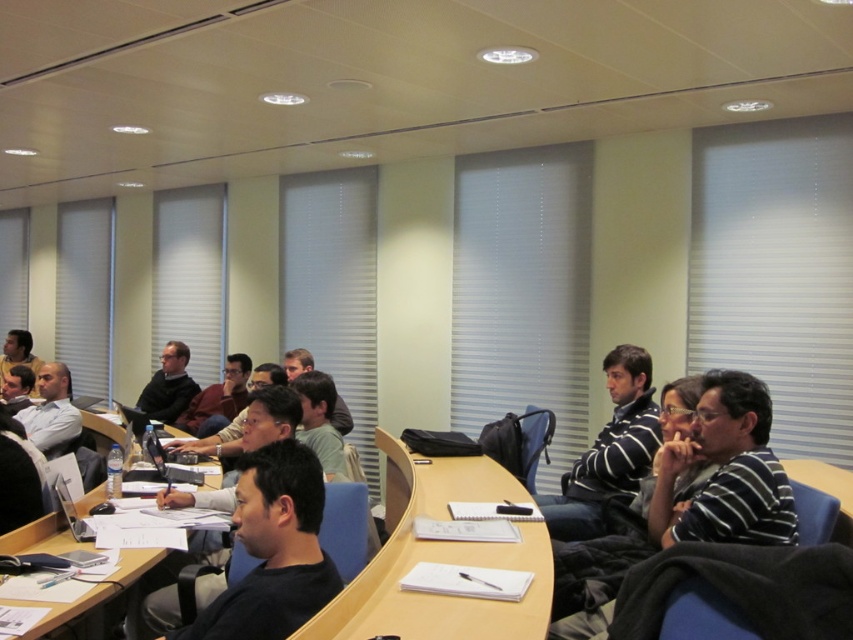
You are organizing a small presentation in the classroom and need to place a laptop on the desk. The laptop requires a space larger than the wooden at center. Can you place it where the matte black glasses at center are currently located?

The wooden at center occupies less space than matte black glasses at center. Since the laptop needs more space than the wooden at center, the area where the matte black glasses at center are placed has enough space to accommodate the laptop.

You are a participant in the classroom and want to place your notebook on the desk. Where should you place it so that it is exactly at the center of the desk? Please provide the coordinates in the format of a point like this example format of point format is point 0.936, 0.132. The desk has a white paper at center.

The white paper at center is located at point (112, 598), so you should place your notebook at the same coordinates to have it exactly at the center of the desk.

You are a person who needs to reach the matte black glasses at center from the wooden at center. Can you do so without moving more than 6 feet?

The wooden at center is 6.19 feet from matte black glasses at center, so no, you cannot reach the matte black glasses at center from the wooden at center without moving more than 6 feet.